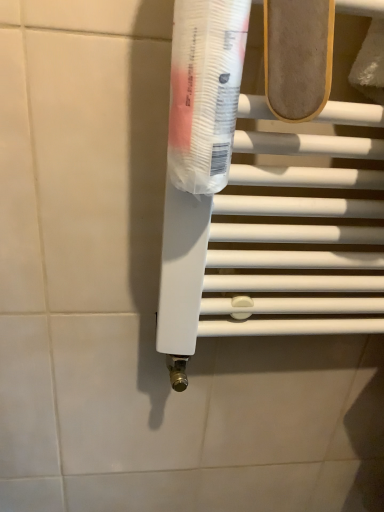
Question: Can you confirm if light brown suede shoe at upper center is taller than white plastic towel bar at center?

Choices:
 (A) yes
 (B) no

Answer: (B)

Question: Does light brown suede shoe at upper center appear on the right side of white plastic towel bar at center?

Choices:
 (A) yes
 (B) no

Answer: (B)

Question: Would you say white plastic towel bar at center is part of light brown suede shoe at upper center's contents?

Choices:
 (A) yes
 (B) no

Answer: (B)

Question: Does light brown suede shoe at upper center have a greater width compared to white plastic towel bar at center?

Choices:
 (A) no
 (B) yes

Answer: (A)

Question: Could you tell me if light brown suede shoe at upper center is turned towards white plastic towel bar at center?

Choices:
 (A) yes
 (B) no

Answer: (B)

Question: Is point coord(228,92) positioned closer to the camera than point coord(251,273)?

Choices:
 (A) closer
 (B) farther

Answer: (A)

Question: From their relative heights in the image, would you say transparent plastic tube at center is taller or shorter than white plastic towel bar at center?

Choices:
 (A) tall
 (B) short

Answer: (B)

Question: In the image, is transparent plastic tube at center positioned in front of or behind white plastic towel bar at center?

Choices:
 (A) front
 (B) behind

Answer: (A)

Question: Visually, is transparent plastic tube at center positioned to the left or to the right of white plastic towel bar at center?

Choices:
 (A) right
 (B) left

Answer: (B)

Question: Looking at their shapes, would you say light brown suede shoe at upper center is wider or thinner than white plastic towel bar at center?

Choices:
 (A) thin
 (B) wide

Answer: (A)

Question: Is light brown suede shoe at upper center situated inside white plastic towel bar at center or outside?

Choices:
 (A) inside
 (B) outside

Answer: (B)

Question: From a real-world perspective, relative to white plastic towel bar at center, is light brown suede shoe at upper center vertically above or below?

Choices:
 (A) above
 (B) below

Answer: (A)

Question: From their relative heights in the image, would you say light brown suede shoe at upper center is taller or shorter than white plastic towel bar at center?

Choices:
 (A) short
 (B) tall

Answer: (A)

Question: In terms of height, does light brown suede shoe at upper center look taller or shorter compared to transparent plastic tube at center?

Choices:
 (A) tall
 (B) short

Answer: (B)

Question: Is light brown suede shoe at upper center inside the boundaries of transparent plastic tube at center, or outside?

Choices:
 (A) inside
 (B) outside

Answer: (B)